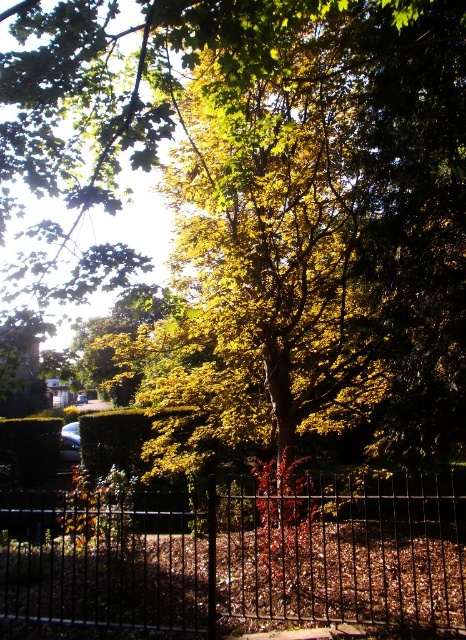
Question: Does black metal fence at lower center have a greater width compared to green leafy hedge at lower left?

Choices:
 (A) yes
 (B) no

Answer: (A)

Question: Is black metal fence at lower center above green leafy hedge at lower left?

Choices:
 (A) yes
 (B) no

Answer: (A)

Question: Is black metal fence at lower center behind green leafy hedge at lower left?

Choices:
 (A) yes
 (B) no

Answer: (B)

Question: Which point appears farthest from the camera in this image?

Choices:
 (A) (18, 465)
 (B) (47, 509)

Answer: (A)